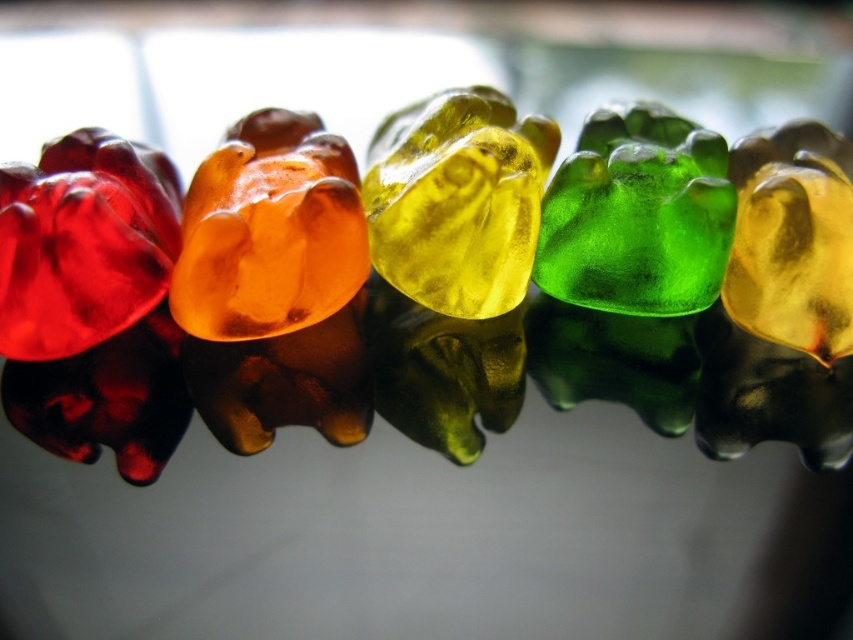
Question: Can you confirm if translucent yellow jelly bear at center is positioned above green translucent gummy bear at center?

Choices:
 (A) no
 (B) yes

Answer: (B)

Question: Which of the following is the closest to the observer?

Choices:
 (A) (363, 180)
 (B) (703, 301)

Answer: (B)

Question: Does translucent yellow jelly bear at center have a lesser width compared to green translucent gummy bear at center?

Choices:
 (A) no
 (B) yes

Answer: (A)

Question: Is translucent yellow jelly bear at center wider than green translucent gummy bear at center?

Choices:
 (A) yes
 (B) no

Answer: (A)